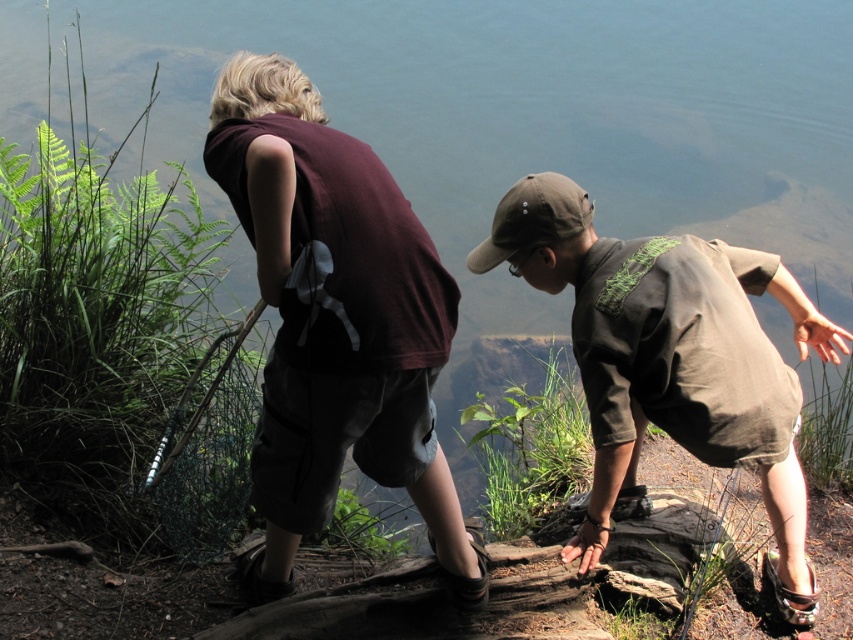
Looking at this image, you are standing at the point labeled point (x=380, y=474) and want to walk towards the point labeled point (x=722, y=355). Considering the spatial relationship between these two points, will you be moving towards the background of the image or towards the foreground?

Since point (x=380, y=474) is closer to the viewer than point (x=722, y=355), moving from point (x=380, y=474) to point (x=722, y=355) means you are moving towards the background of the image.

You are a photographer trying to capture a candid shot of both the maroon fabric shirt at center and the brown cotton shirt at center in the scene. Your camera has a maximum focus range of 75 centimeters. Can you capture both subjects in focus without moving your position?

The maroon fabric shirt at center is 77.15 centimeters from the brown cotton shirt at center. Since the distance between them exceeds the camera focus range of 75 centimeters, you cannot capture both subjects in focus without adjusting your position.

Looking at this image, you are a photographer trying to capture both the maroon fabric shirt at center and the brown cotton shirt at center in a single shot. Based on their positions, which shirt should you focus on first to ensure both are in the frame?

You should focus on the maroon fabric shirt at center first since it is in front of the brown cotton shirt at center, ensuring both are visible in the frame.